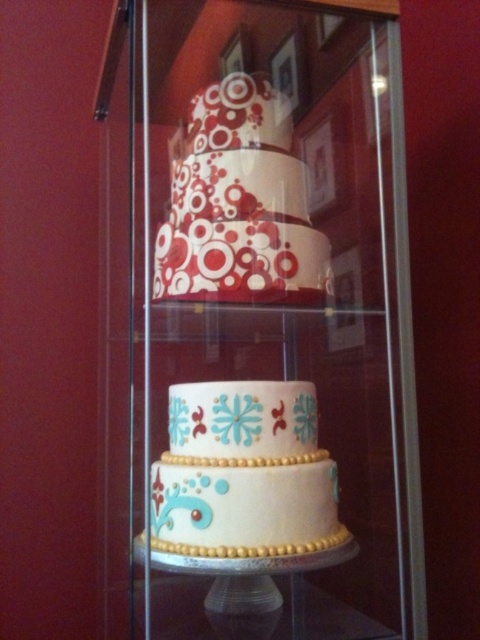
Is transparent glass door at center smaller than white fondant cake at center?

No.

Is transparent glass door at center above white fondant cake at center?

Yes, transparent glass door at center is above white fondant cake at center.

Is point (417, 554) behind point (197, 417)?

No, (417, 554) is closer to viewer.

Find the location of a particular element. transparent glass door at center is located at coordinates (256, 317).

Who is higher up, transparent glass door at center or white glossy glass plate at center?

transparent glass door at center

Is point (315, 44) in front of point (155, 561)?

No, it is behind (155, 561).

Identify the location of transparent glass door at center. This screenshot has width=480, height=640. (256, 317).

Between point (165, 288) and point (312, 557), which one is positioned behind?

The point (165, 288) is more distant.

Does matte red and white cake at center have a greater width compared to white glossy glass plate at center?

In fact, matte red and white cake at center might be narrower than white glossy glass plate at center.

Locate an element on the screen. matte red and white cake at center is located at coordinates (239, 204).